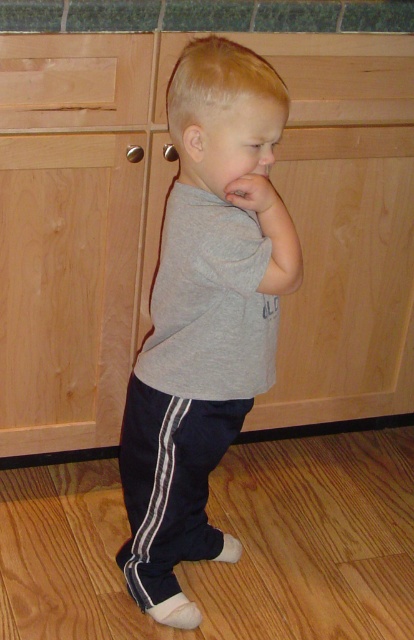
Question: Estimate the real-world distances between objects in this image. Which object is farther from the heather gray t-shirt at center?

Choices:
 (A) gray matte shirt at center
 (B) matte gray hand at center
 (C) beech wood drawer at upper left
 (D) wooden at upper center

Answer: (D)

Question: Which object is closer to the camera taking this photo?

Choices:
 (A) beech wood drawer at upper left
 (B) gray matte shirt at center
 (C) heather gray t-shirt at center

Answer: (B)

Question: Is heather gray t-shirt at center smaller than wooden at upper center?

Choices:
 (A) yes
 (B) no

Answer: (B)

Question: Which object is the closest to the wooden at upper center?

Choices:
 (A) heather gray t-shirt at center
 (B) beech wood drawer at upper left
 (C) gray matte shirt at center

Answer: (B)

Question: Can you confirm if gray matte shirt at center is wider than matte gray hand at center?

Choices:
 (A) yes
 (B) no

Answer: (A)

Question: Does gray matte shirt at center appear on the left side of wooden at upper center?

Choices:
 (A) no
 (B) yes

Answer: (B)